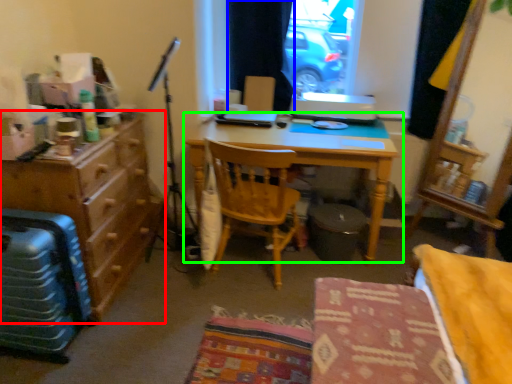
Question: Considering the real-world distances, which object is closest to cabinetry (highlighted by a red box)? curtain (highlighted by a blue box) or desk (highlighted by a green box).

Choices:
 (A) curtain
 (B) desk

Answer: (B)